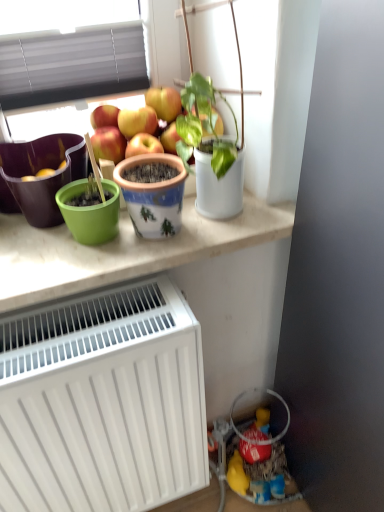
Question: From the image's perspective, is green plastic pot at upper center positioned above or below green matte flowerpot at left, the first flowerpot positioned from the left?

Choices:
 (A) above
 (B) below

Answer: (B)

Question: Is green plastic pot at upper center situated inside green matte flowerpot at left, which is the 2th flowerpot in right-to-left order, or outside?

Choices:
 (A) outside
 (B) inside

Answer: (A)

Question: Which object is the closest to the white glossy pot at upper center?

Choices:
 (A) white matte radiator at lower left
 (B) green plastic pot at upper center
 (C) green matte flowerpot at left, which is the 2th flowerpot in right-to-left order
 (D) painted ceramic pot at center, which ranks as the 1th flowerpot in right-to-left order

Answer: (D)

Question: Which of these objects is positioned closest to the green plastic pot at upper center?

Choices:
 (A) painted ceramic pot at center, which ranks as the 1th flowerpot in right-to-left order
 (B) white glossy pot at upper center
 (C) white matte radiator at lower left
 (D) green matte flowerpot at left, the first flowerpot positioned from the left

Answer: (A)